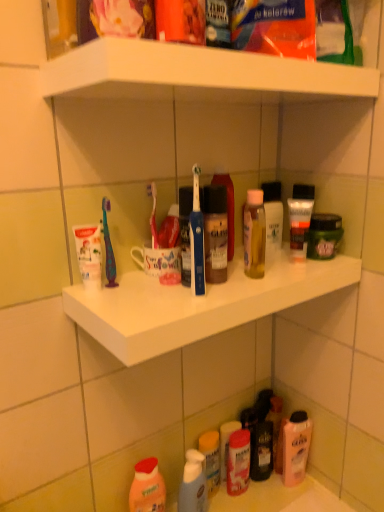
Identify the location of vacant area that lies in front of translucent plastic tube at upper center, the third toiletry from the left. The image size is (384, 512). [x=281, y=279].